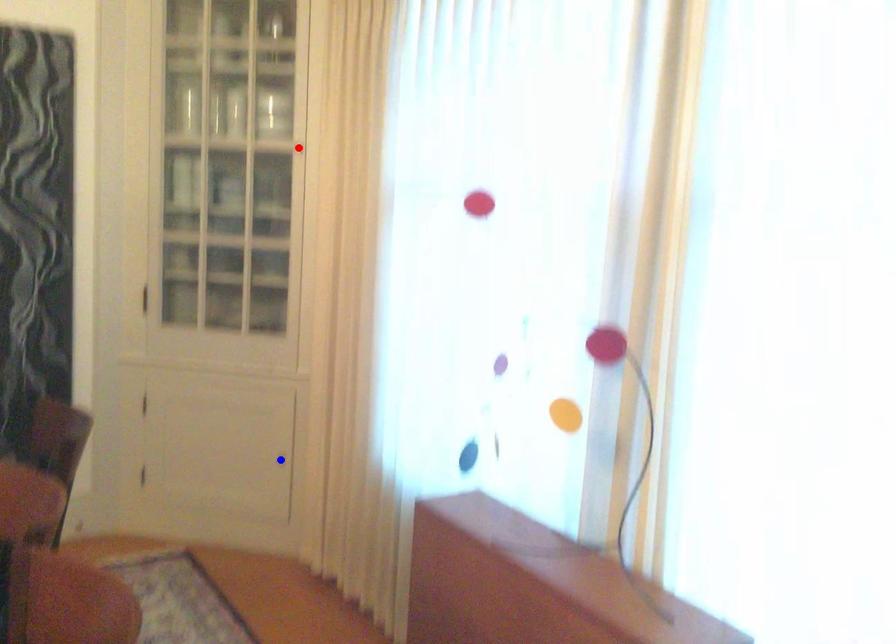
Question: Which of the two points in the image is closer to the camera?

Choices:
 (A) Blue point is closer.
 (B) Red point is closer.

Answer: (B)